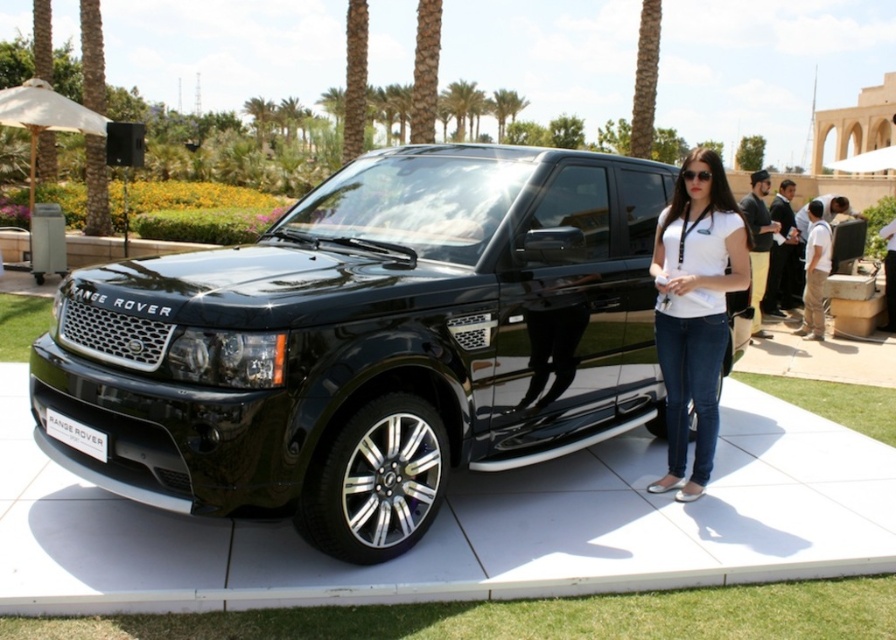
You are standing in front of the black metallic car at center and the white matte shirt at center. Which object is positioned to your right?

The white matte shirt at center is positioned to your right since the black metallic car at center is to the left of it.

You are a photographer standing behind the black metallic car at center and the white matte shirt at center. Which object is closer to the camera?

The black metallic car at center is closer to the camera because it is positioned above the white matte shirt at center, indicating it is in front in the visual hierarchy.

Based on the photo, you are a photographer trying to capture a wide shot of the black metallic car at center and the white matte shirt at center. If the car is wider than the shirt, will it occupy more space in the photo?

The black metallic car at center might be wider than white matte shirt at center, so it will likely occupy more space in the photo.